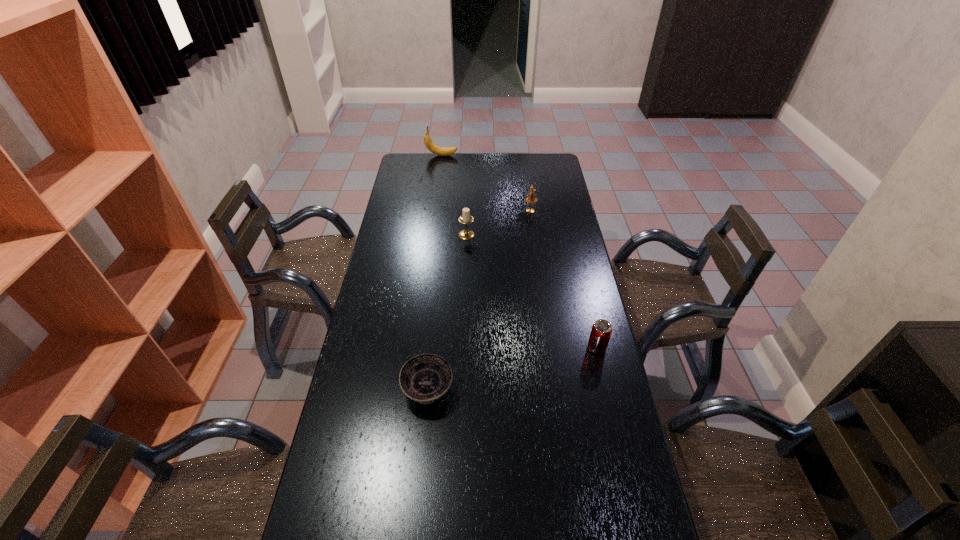
This screenshot has height=540, width=960. In the image, there is a desktop. What are the coordinates of `vacant space at the left edge` in the screenshot? It's located at (329, 519).

Locate an element on the screen. free location at the right edge is located at coordinates (577, 396).

This screenshot has width=960, height=540. What are the coordinates of `vacant space at the far left corner` in the screenshot? It's located at (430, 165).

Where is `free point between the nearest object and the soda can`? The image size is (960, 540). free point between the nearest object and the soda can is located at coordinates 512,369.

Locate an element on the screen. This screenshot has height=540, width=960. free area in between the left candle holder and the fourth nearest object is located at coordinates (498, 222).

Find the location of a particular element. empty space that is in between the bowl and the second farthest object is located at coordinates (479, 300).

Image resolution: width=960 pixels, height=540 pixels. What are the coordinates of `vacant space that is in between the fourth farthest object and the left candle holder` in the screenshot? It's located at (532, 292).

This screenshot has width=960, height=540. What are the coordinates of `free space between the bowl and the third nearest object` in the screenshot? It's located at (447, 312).

Locate which object ranks second in proximity to the nearer candle holder. Please provide its 2D coordinates. Your answer should be formatted as a tuple, i.e. [(x, y)], where the tuple contains the x and y coordinates of a point satisfying the conditions above.

[(442, 151)]

This screenshot has height=540, width=960. What are the coordinates of `object that is the closest one to the left candle holder` in the screenshot? It's located at (531, 198).